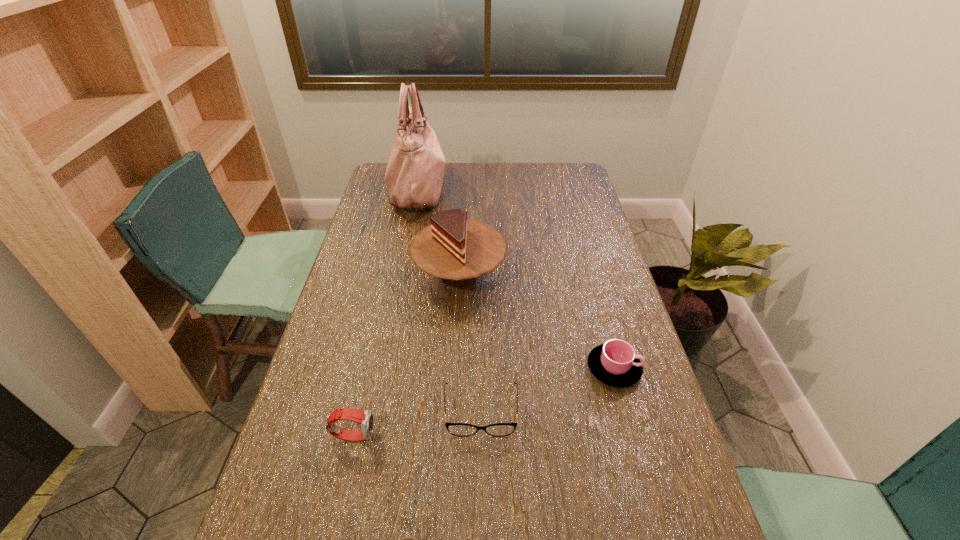
The height and width of the screenshot is (540, 960). What are the coordinates of `free space located 0.290m on the right of the cake` in the screenshot? It's located at (595, 275).

Image resolution: width=960 pixels, height=540 pixels. What are the coordinates of `blank area located 0.320m on the face of the taller watch` in the screenshot? It's located at (513, 435).

Find the location of a particular element. The width and height of the screenshot is (960, 540). vacant space located 0.140m on the front-facing side of the spectacles is located at coordinates (481, 500).

Locate an element on the screen. This screenshot has width=960, height=540. object positioned at the far edge is located at coordinates (414, 175).

Locate an element on the screen. The width and height of the screenshot is (960, 540). handbag that is at the left edge is located at coordinates (414, 175).

This screenshot has height=540, width=960. What are the coordinates of `watch located at the left edge` in the screenshot? It's located at [365, 418].

In order to click on object that is positioned at the right edge in this screenshot , I will do `click(614, 363)`.

Where is `object situated at the far left corner`? object situated at the far left corner is located at coordinates (414, 175).

Identify the location of vacant space at the far edge. The width and height of the screenshot is (960, 540). (463, 179).

The image size is (960, 540). In the image, there is a desktop. In order to click on vacant space at the left edge in this screenshot , I will do `click(284, 492)`.